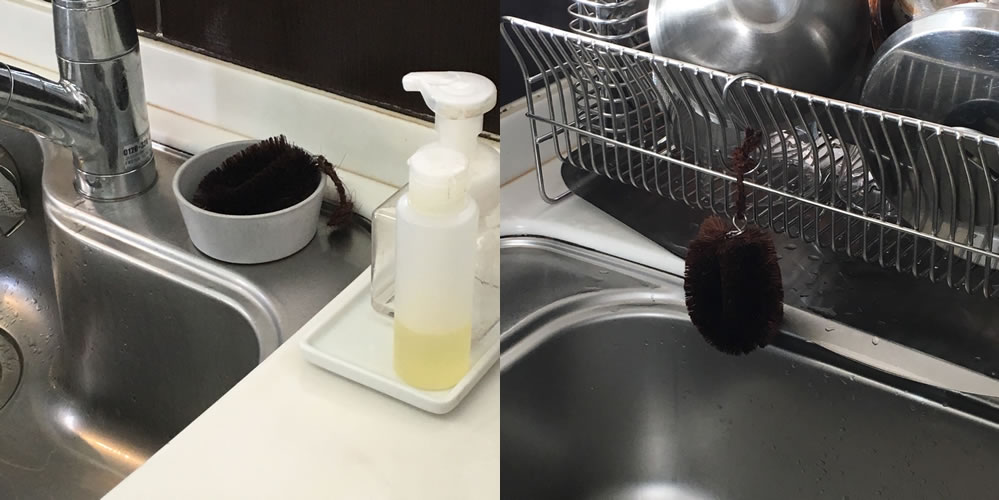
You are a GUI agent. You are given a task and a screenshot of the screen. Output one action in this format:
    pyautogui.click(x=<x>, y=<y>)
    Task: Click on the faucet
    The image size is (999, 500).
    Given the screenshot: What is the action you would take?
    pyautogui.click(x=60, y=104)